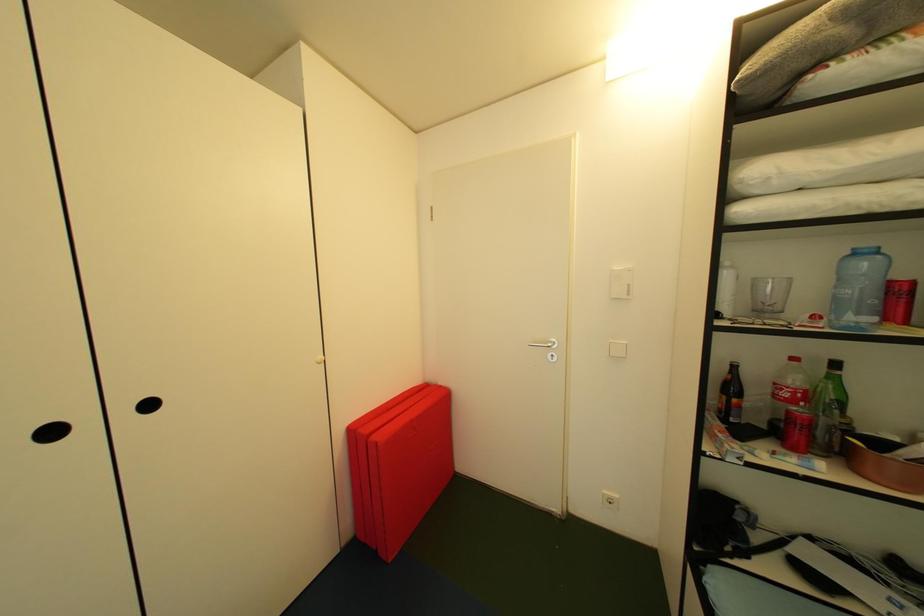
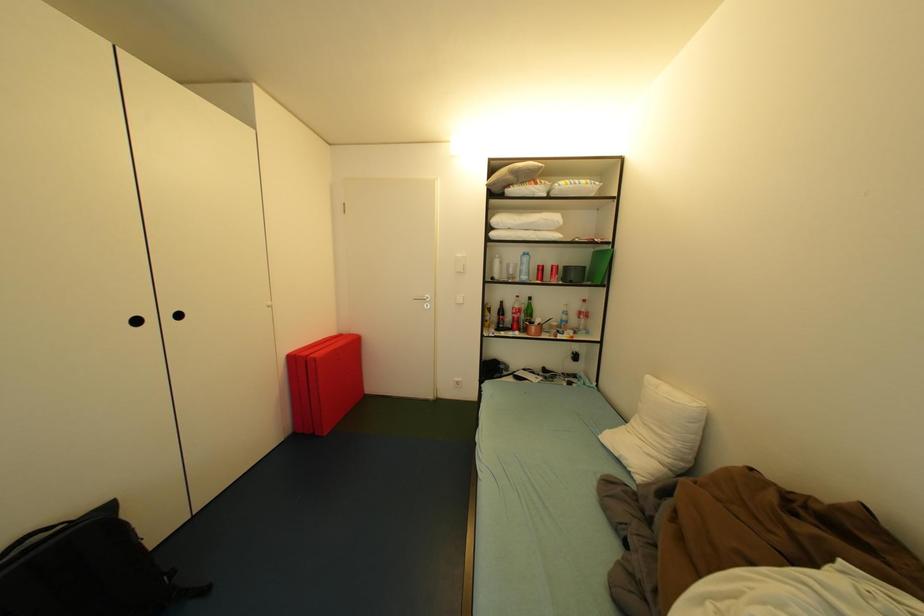
Question: The images are taken continuously from a first-person perspective. In which direction is your viewpoint rotating?

Choices:
 (A) Left
 (B) Right
 (C) Up
 (D) Down

Answer: (B)